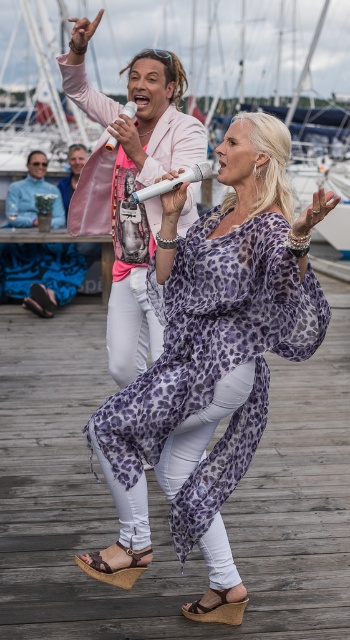
Question: Estimate the real-world distances between objects in this image. Which object is farther from the brown cork wedge sandal at lower center?

Choices:
 (A) brown leather sandal at lower center
 (B) light blue shirt at upper left
 (C) purple leopard print dress at center
 (D) brown suede sandal at lower center

Answer: (B)

Question: Is brown suede sandal at lower center above light blue shirt at upper left?

Choices:
 (A) yes
 (B) no

Answer: (B)

Question: Which object is the closest to the light blue shirt at upper left?

Choices:
 (A) blue fabric at lower left
 (B) brown cork wedge sandal at lower center
 (C) purple leopard print dress at center
 (D) brown leather sandal at lower center

Answer: (A)

Question: Is light blue shirt at upper left further to camera compared to brown leather sandal at lower center?

Choices:
 (A) no
 (B) yes

Answer: (B)

Question: Which object is the farthest from the light blue shirt at upper left?

Choices:
 (A) brown suede sandal at lower center
 (B) brown cork wedge sandal at lower center
 (C) brown leather sandal at lower center
 (D) blue fabric at lower left

Answer: (A)

Question: Can you confirm if blue fabric at lower left is positioned to the right of brown cork wedge sandal at lower center?

Choices:
 (A) no
 (B) yes

Answer: (A)